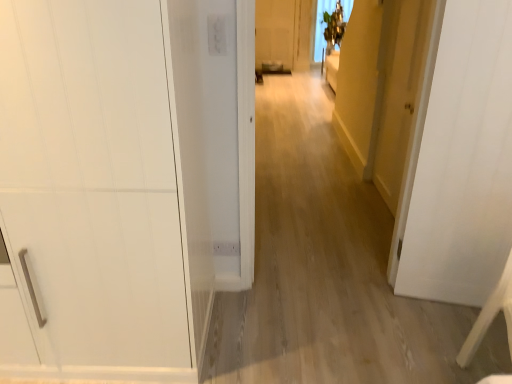
Identify the location of vacant space in front of yellow matte door at right, marked as the 3th door in a left-to-right arrangement. The width and height of the screenshot is (512, 384). (370, 220).